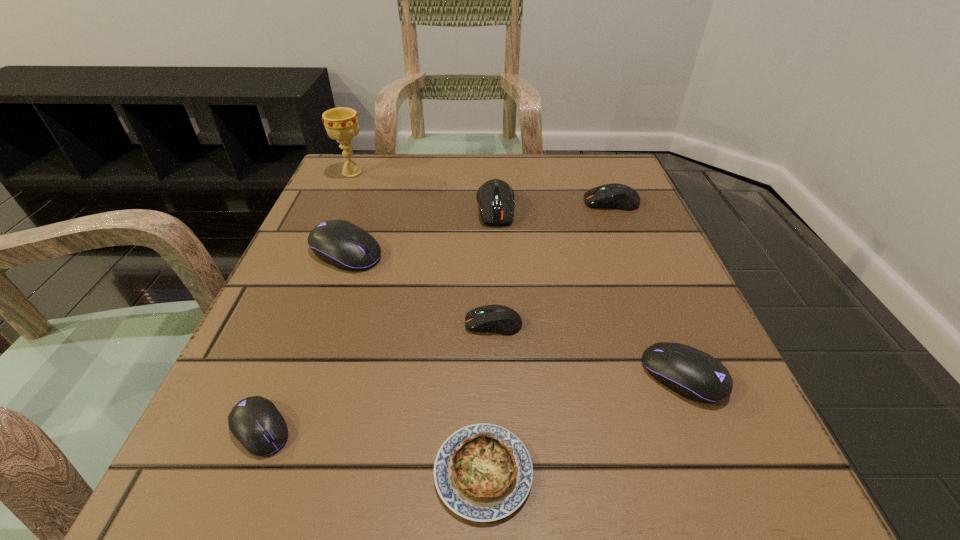
Where is `quiche`? quiche is located at coordinates (483, 472).

At what (x,y) coordinates should I click in order to perform the action: click on vacant space located 0.290m on the right of the tallest object. Please return your answer as a coordinate pair (x, y). Looking at the image, I should click on (490, 173).

Find the location of a particular element. The height and width of the screenshot is (540, 960). vacant space located on the button of the biggest dark computer equipment is located at coordinates (498, 256).

Where is `blank space located on the right of the biggest black computer mouse`? The width and height of the screenshot is (960, 540). blank space located on the right of the biggest black computer mouse is located at coordinates (596, 252).

Locate an element on the screen. blank space located on the button of the second biggest dark computer equipment is located at coordinates (441, 202).

What are the coordinates of `vacant space located on the button of the second biggest dark computer equipment` in the screenshot? It's located at coord(445,202).

This screenshot has width=960, height=540. I want to click on vacant space located on the button of the second biggest dark computer equipment, so click(x=496, y=202).

Where is `vacant space located on the front of the rightmost black computer mouse`? The width and height of the screenshot is (960, 540). vacant space located on the front of the rightmost black computer mouse is located at coordinates (721, 468).

Where is `vacant space situated 0.220m on the button of the smallest dark computer equipment`? This screenshot has height=540, width=960. vacant space situated 0.220m on the button of the smallest dark computer equipment is located at coordinates (325, 323).

Find the location of `vacant region located on the button of the smallest dark computer equipment`. vacant region located on the button of the smallest dark computer equipment is located at coordinates (383, 323).